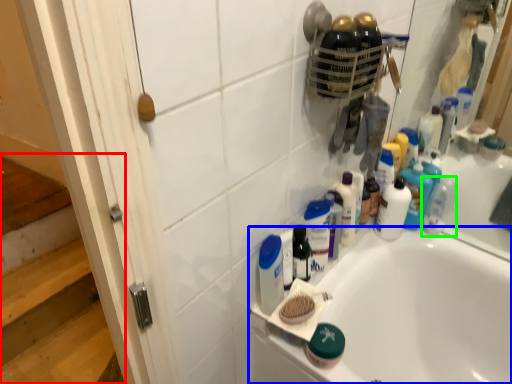
Question: Which is farther away from stairwell (highlighted by a red box)? bathtub (highlighted by a blue box) or toiletry (highlighted by a green box)?

Choices:
 (A) bathtub
 (B) toiletry

Answer: (B)